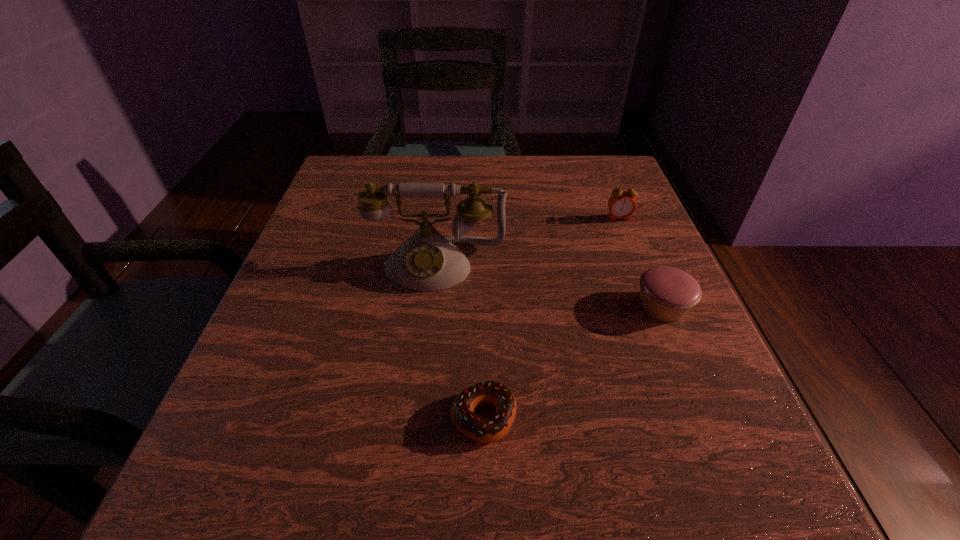
Locate an element on the screen. Image resolution: width=960 pixels, height=540 pixels. telephone is located at coordinates (427, 261).

The width and height of the screenshot is (960, 540). In order to click on the third shortest object in this screenshot , I will do `click(621, 204)`.

This screenshot has height=540, width=960. Identify the location of alarm clock. (621, 204).

Image resolution: width=960 pixels, height=540 pixels. I want to click on cupcake, so click(667, 293).

You are a GUI agent. You are given a task and a screenshot of the screen. Output one action in this format:
    pyautogui.click(x=<x>, y=<y>)
    Task: Click on the doughnut
    The width and height of the screenshot is (960, 540).
    Given the screenshot: What is the action you would take?
    pyautogui.click(x=486, y=430)

The width and height of the screenshot is (960, 540). Identify the location of the shortest object. (486, 430).

Find the location of `free space located 0.060m on the dial of the telephone`. free space located 0.060m on the dial of the telephone is located at coordinates (431, 317).

Locate an element on the screen. The image size is (960, 540). free spot located on the face of the alarm clock is located at coordinates (661, 327).

Find the location of a particular element. free location located 0.110m on the left of the second shortest object is located at coordinates (571, 307).

This screenshot has width=960, height=540. I want to click on free point located 0.060m on the right of the doughnut, so click(559, 417).